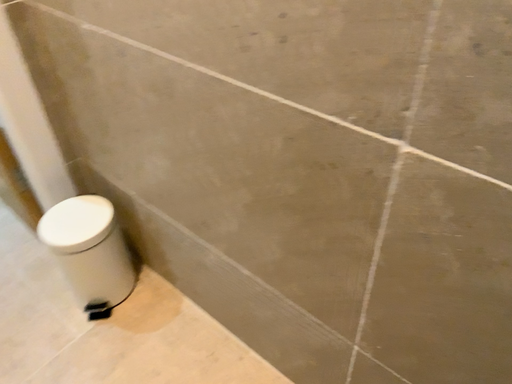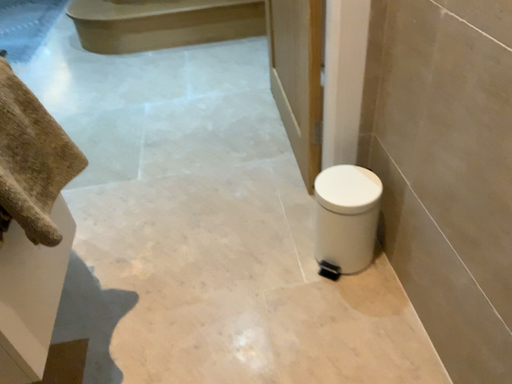
Question: How did the camera likely rotate when shooting the video?

Choices:
 (A) rotated right
 (B) rotated left

Answer: (B)